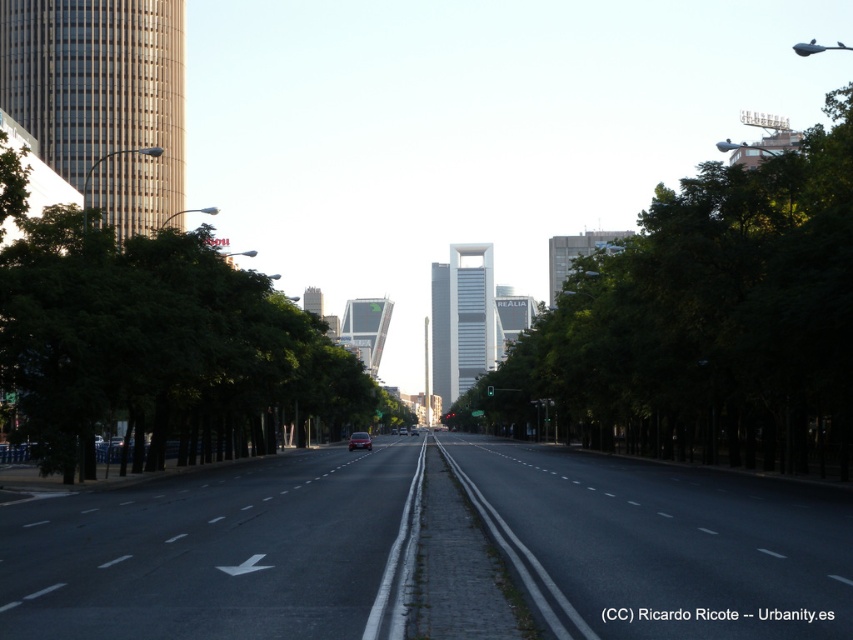
You are a pedestrian standing on the sidewalk. You see a green leafy tree at left and a metallic silver car at center. Which object is taller?

The green leafy tree at left is taller than the metallic silver car at center.

You are a city planner designing a new bike lane that must be placed between the green leafy tree at center and the green leafy tree at left. The minimum required distance between these two trees for the bike lane to fit is 60 feet. Can the bike lane be placed between them?

The green leafy tree at center and green leafy tree at left are 66.55 feet apart from each other, which is more than the required 60 feet. Therefore, the bike lane can be placed between them.